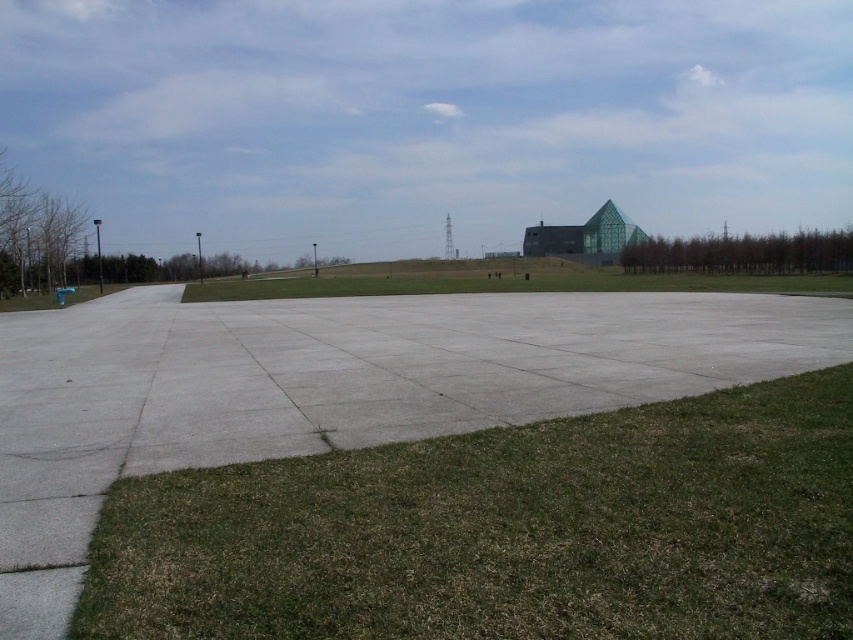
You are a landscape architect planning to install a new walkway between the green grass at lower right and the green grass at center. The walkway must be exactly 80 meters long. Based on the scene, will the walkway fit between them without exceeding the distance?

The green grass at lower right and green grass at center are 87.24 meters apart, so a 80 meter walkway will fit between them since it is shorter than the distance between them.

You are planning to set up a picnic blanket in the plaza. The green grass at lower right and the green grass at center are both potential spots. Which area would provide more space for your blanket?

The green grass at center would provide more space for your picnic blanket since it has a greater width compared to the green grass at lower right.

You are planning to set up a picnic blanket in the plaza. You have two spots in mind based on the grass conditions. Which spot has taller grass between the green grass at lower right and the green grass at center?

The green grass at center has taller grass compared to the green grass at lower right.